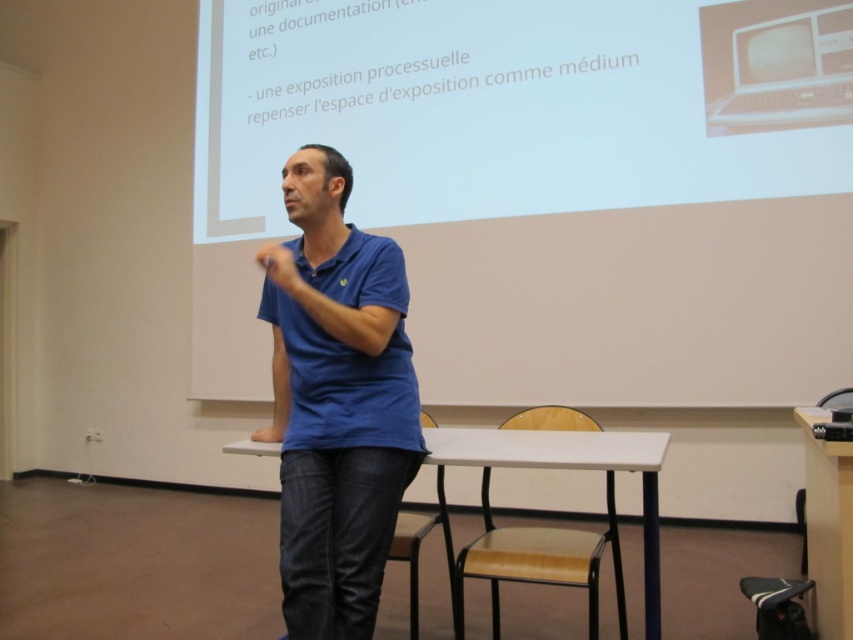
You are a student sitting in the front row of the classroom. The white glossy projector screen at upper center is where the professor is pointing. If you want to take a photo of the screen with your phone, which is 6 inches wide, will the screen fit entirely in your phone camera frame? Assume your phone camera has a field of view of 60 degrees.

The white glossy projector screen at upper center is 11.66 feet from viewer. To determine if it fits, calculate the screen width based on distance and angle. Using trigonometry, the maximum width captured at 60 degrees field of view is 2 x 11.66 ft x tan 30 degrees. This equals approximately 4.09 feet or 49 inches. Since the screen is 49 inches wide and the phone is 6 inches, the screen will fit within the frame.

You are an attendee sitting in the front row of the lecture hall. You notice the white glossy projector screen at upper center and the blue cotton shirt at center. Which object is closer to you?

The white glossy projector screen at upper center is closer to you because it is further to the viewer than the blue cotton shirt at center.